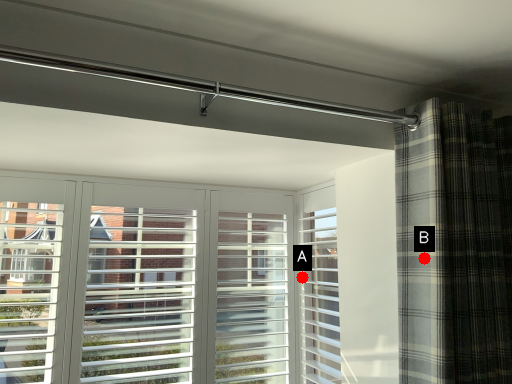
Question: Two points are circled on the image, labeled by A and B beside each circle. Which point is farther to the camera?

Choices:
 (A) A is further
 (B) B is further

Answer: (A)